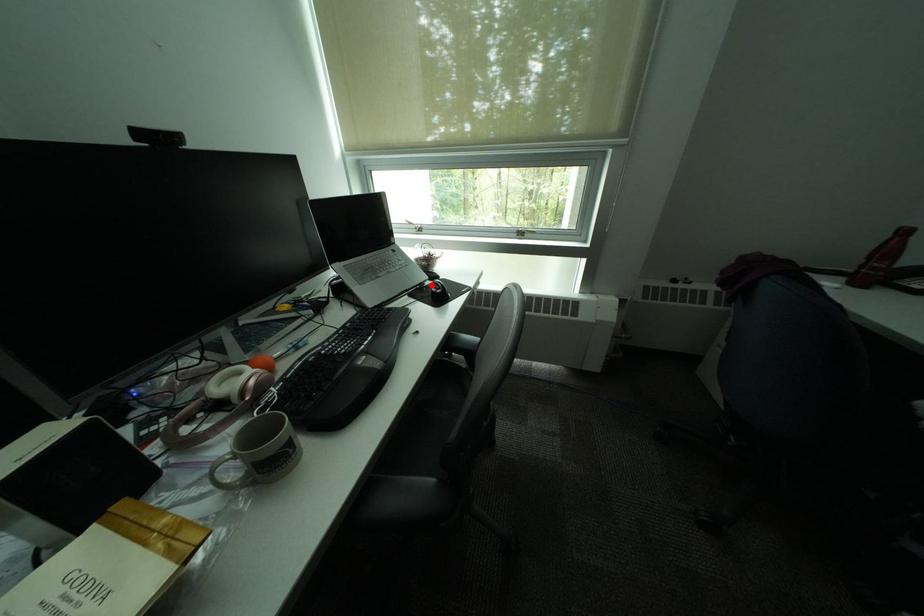
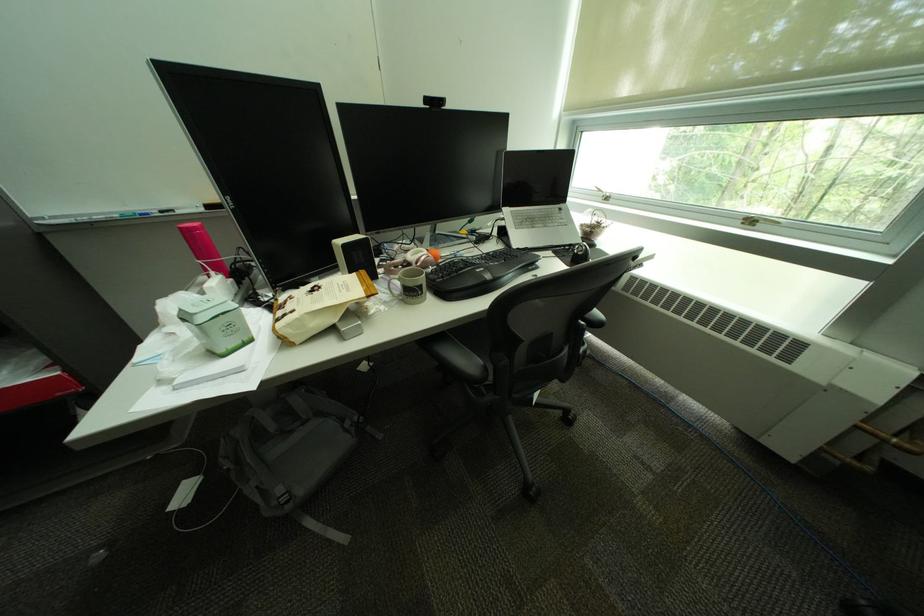
The point at the highlighted location is marked in the first image. Where is the corresponding point in the second image?

(580, 246)